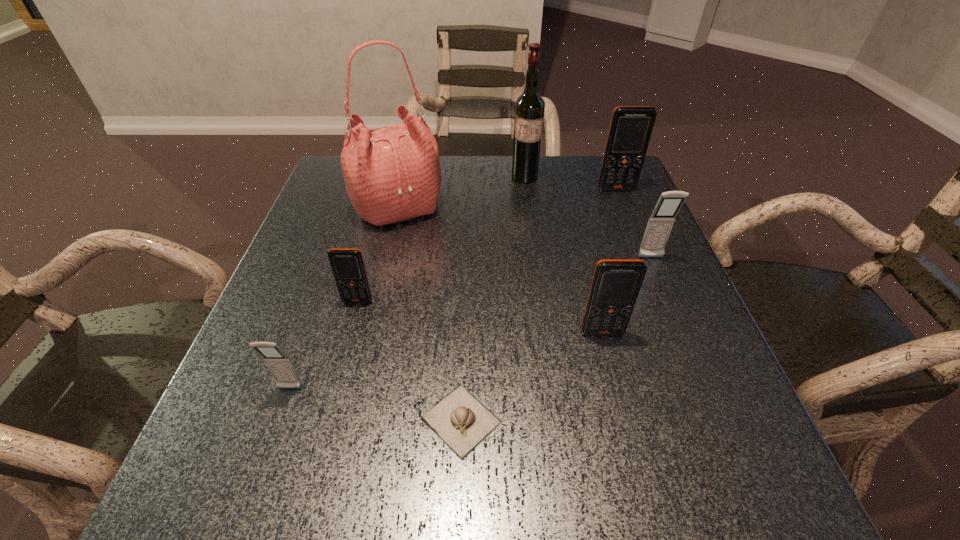
Identify the location of the smallest orange cellular telephone. (347, 265).

The width and height of the screenshot is (960, 540). In order to click on the leftmost cellular telephone in this screenshot , I will do `click(280, 365)`.

This screenshot has width=960, height=540. In order to click on the nearer gray cellular telephone in this screenshot , I will do `click(280, 365)`.

Where is `the shortest object`? The height and width of the screenshot is (540, 960). the shortest object is located at coordinates (459, 419).

The width and height of the screenshot is (960, 540). I want to click on free spot located on the right of the handbag, so (x=574, y=208).

What are the coordinates of `vacant space located 0.380m on the front and back of the wine bottle` in the screenshot? It's located at (539, 284).

This screenshot has width=960, height=540. Identify the location of vacant region located on the screen of the tallest cellular telephone. (660, 297).

The height and width of the screenshot is (540, 960). Identify the location of free region located on the front-facing side of the bigger gray cellular telephone. (685, 342).

Where is `vacant point located 0.220m on the screen of the second orange cellular telephone from right to left`? The height and width of the screenshot is (540, 960). vacant point located 0.220m on the screen of the second orange cellular telephone from right to left is located at coordinates (633, 454).

Where is `vacant region located on the screen of the smallest orange cellular telephone`? vacant region located on the screen of the smallest orange cellular telephone is located at coordinates (324, 427).